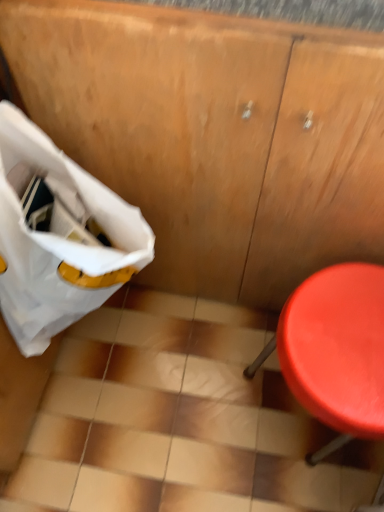
Question: Should I look upward or downward to see smooth plastic stool at right?

Choices:
 (A) down
 (B) up

Answer: (A)

Question: Is the position of smooth plastic stool at right more distant than that of white fabric bag at left?

Choices:
 (A) yes
 (B) no

Answer: (A)

Question: Does smooth plastic stool at right have a lesser height compared to white fabric bag at left?

Choices:
 (A) no
 (B) yes

Answer: (B)

Question: From the image's perspective, is smooth plastic stool at right on top of white fabric bag at left?

Choices:
 (A) yes
 (B) no

Answer: (B)

Question: From the image's perspective, does smooth plastic stool at right appear lower than white fabric bag at left?

Choices:
 (A) yes
 (B) no

Answer: (A)

Question: Can you confirm if smooth plastic stool at right is bigger than white fabric bag at left?

Choices:
 (A) no
 (B) yes

Answer: (B)

Question: Is smooth plastic stool at right to the left of white fabric bag at left from the viewer's perspective?

Choices:
 (A) yes
 (B) no

Answer: (B)

Question: From a real-world perspective, does white fabric bag at left sit lower than smooth plastic stool at right?

Choices:
 (A) no
 (B) yes

Answer: (A)

Question: Considering the relative sizes of white fabric bag at left and smooth plastic stool at right in the image provided, is white fabric bag at left smaller than smooth plastic stool at right?

Choices:
 (A) yes
 (B) no

Answer: (A)

Question: Does white fabric bag at left have a lesser width compared to smooth plastic stool at right?

Choices:
 (A) no
 (B) yes

Answer: (B)

Question: From the image's perspective, is white fabric bag at left located above smooth plastic stool at right?

Choices:
 (A) yes
 (B) no

Answer: (A)

Question: From a real-world perspective, does white fabric bag at left stand above smooth plastic stool at right?

Choices:
 (A) yes
 (B) no

Answer: (A)

Question: Considering the relative positions of white fabric bag at left and smooth plastic stool at right in the image provided, is white fabric bag at left to the right of smooth plastic stool at right from the viewer's perspective?

Choices:
 (A) no
 (B) yes

Answer: (A)

Question: In terms of height, does smooth plastic stool at right look taller or shorter compared to white fabric bag at left?

Choices:
 (A) short
 (B) tall

Answer: (A)